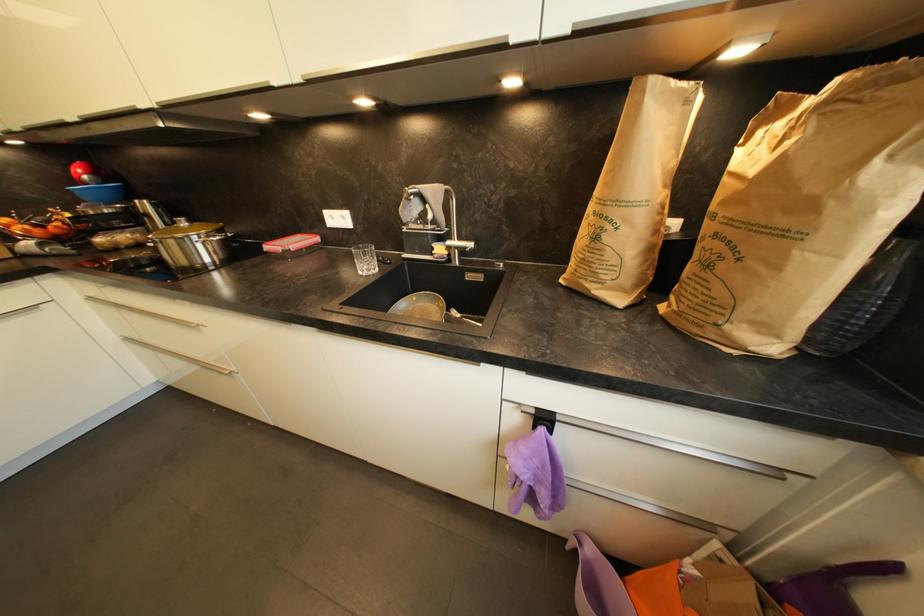
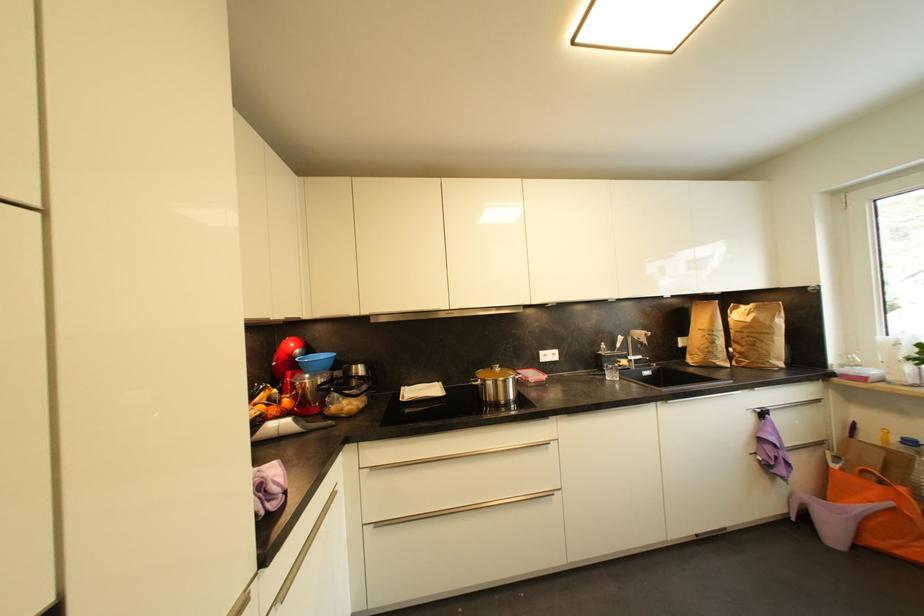
In the second image, find the point that corresponds to (601,240) in the first image.

(718, 345)